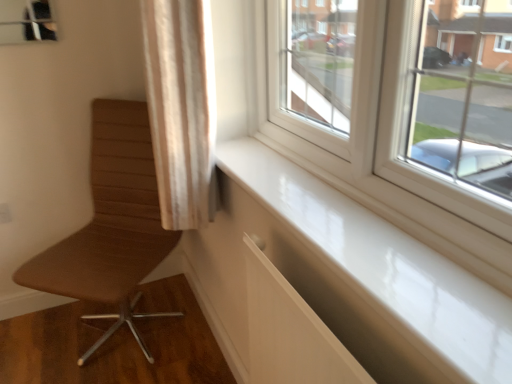
You are a GUI agent. You are given a task and a screenshot of the screen. Output one action in this format:
    pyautogui.click(x=<x>, y=<y>)
    Task: Click on the empty space that is ontop of white glossy window sill at lower right (from a real-world perspective)
    The width and height of the screenshot is (512, 384).
    Given the screenshot: What is the action you would take?
    pyautogui.click(x=318, y=207)